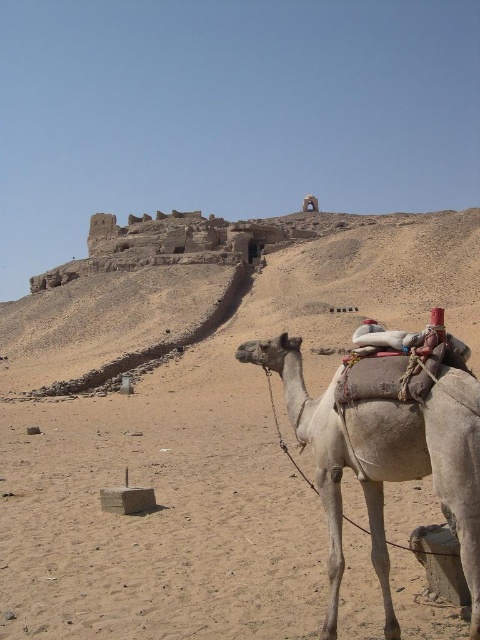
You are a traveler in the desert and see the camel and the beige sandy desert at center marked by point [212,454]. Which direction should you walk to reach the beige sandy desert at center from the camel?

The beige sandy desert at center is marked by point [212,454], so you should walk towards the center of the desert to reach it from the camel.

You are a traveler in the desert and need to decide where to place your tent. You have two options near the beige sandy desert at center and the light beige textured camel at lower right. Which location would provide more space for your tent?

The beige sandy desert at center has a larger size compared to the light beige textured camel at lower right, so placing the tent near the beige sandy desert at center would provide more space.

You are a traveler in the desert and see the beige sandy desert at center and the light beige textured camel at lower right. Which object is closer to you?

The light beige textured camel at lower right is closer to you because it is positioned under the beige sandy desert at center.